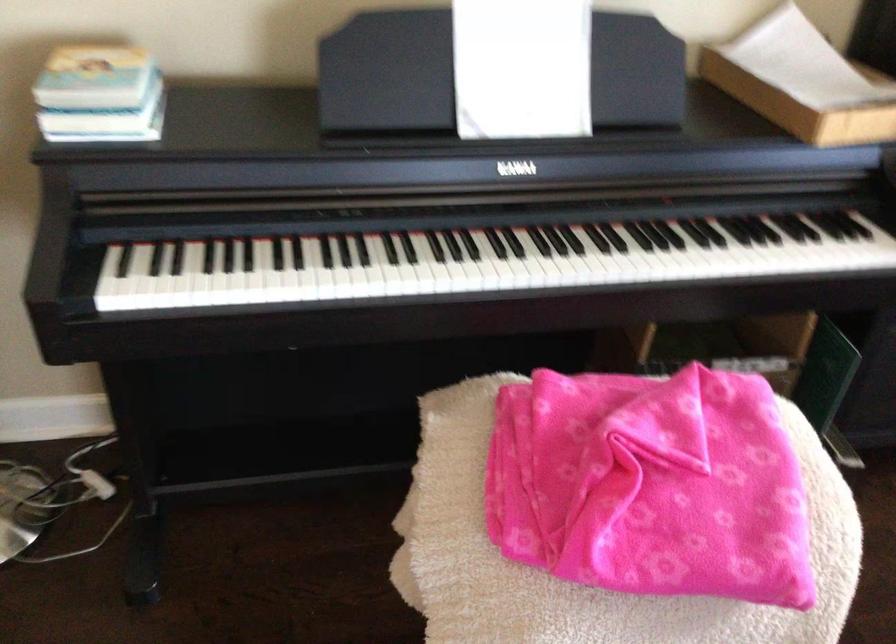
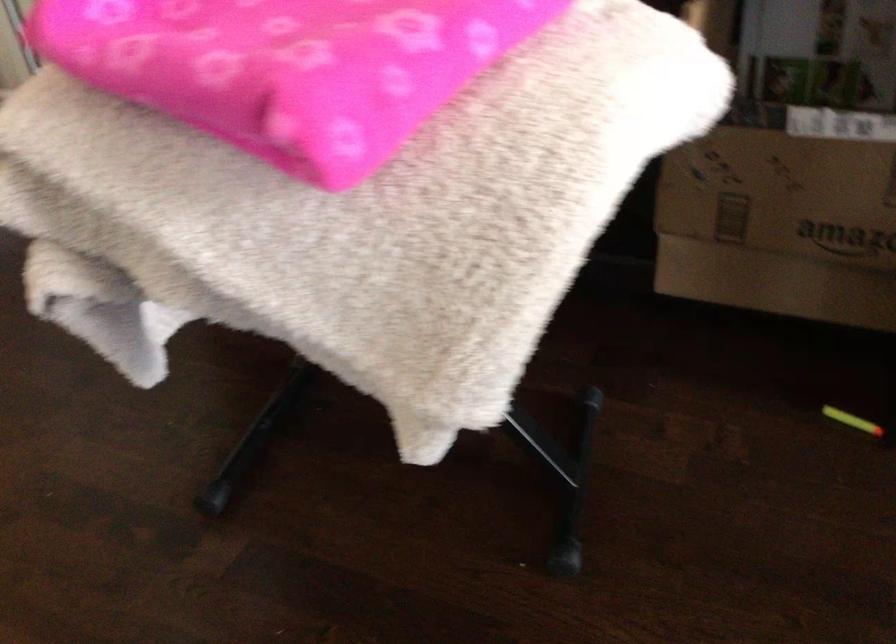
Question: The images are taken continuously from a first-person perspective. In which direction is your viewpoint rotating?

Choices:
 (A) Left
 (B) Right
 (C) Up
 (D) Down

Answer: (A)